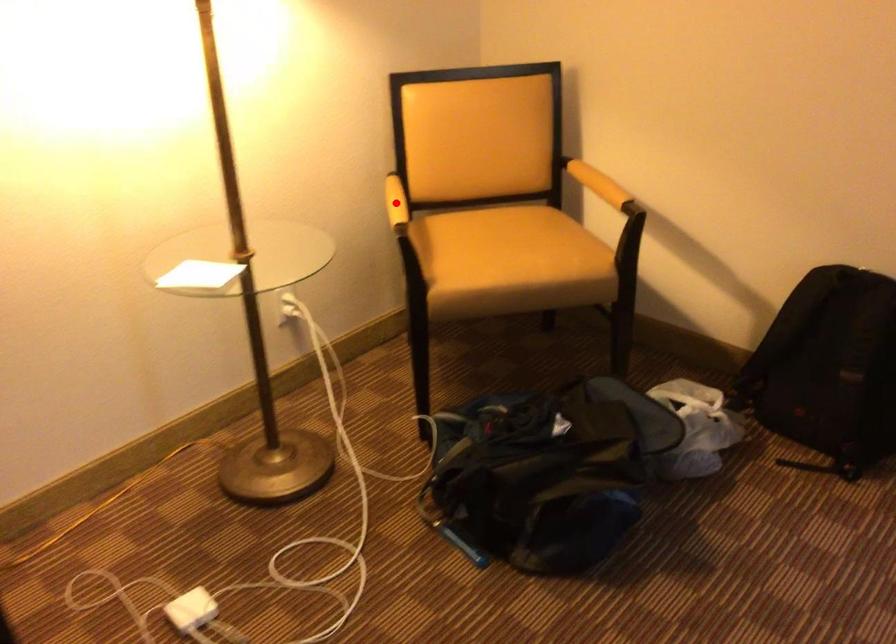
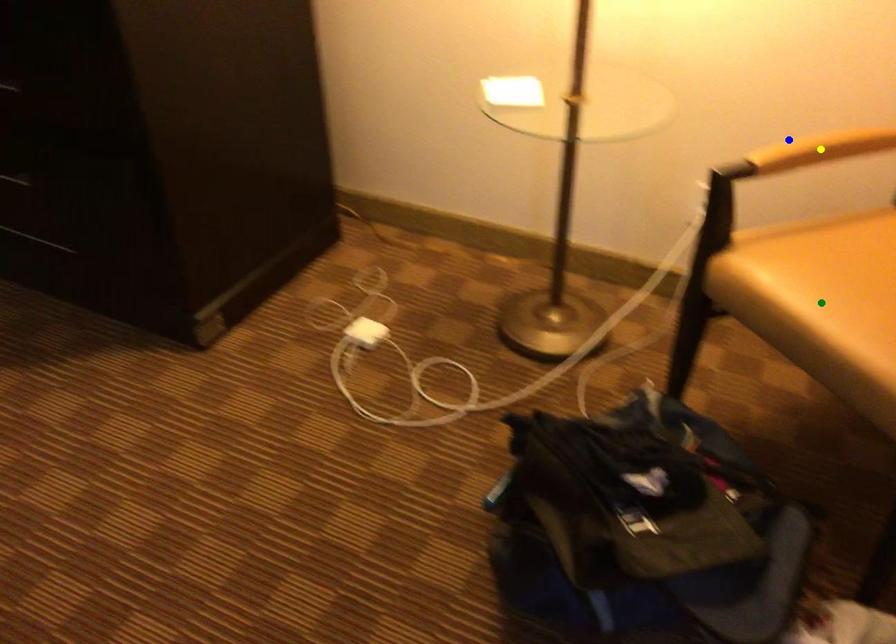
Question: I am providing you with two images of the same scene from different viewpoints. A red point is marked on the first image. You are given multiple points on the second image. Which point in image 2 is actually the same real-world point as the red point in image 1?

Choices:
 (A) blue point
 (B) yellow point
 (C) green point

Answer: (A)